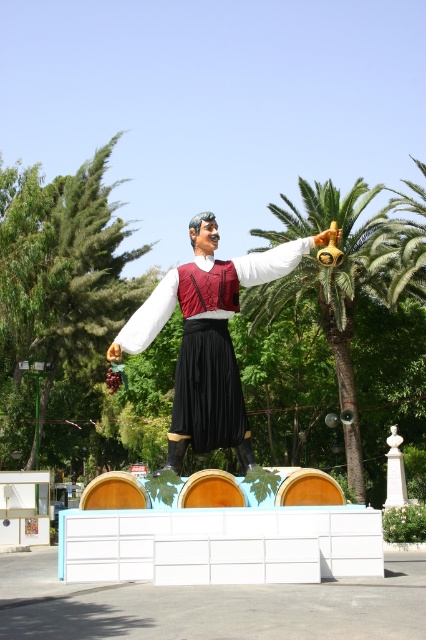
Can you confirm if matte black statue at center is wider than green leafy palm tree at center?

In fact, matte black statue at center might be narrower than green leafy palm tree at center.

Does matte black statue at center have a smaller size compared to green leafy palm tree at center?

Indeed, matte black statue at center has a smaller size compared to green leafy palm tree at center.

Is point (187, 444) less distant than point (360, 204)?

Yes, point (187, 444) is in front of point (360, 204).

Image resolution: width=426 pixels, height=640 pixels. In order to click on matte black statue at center in this screenshot , I will do `click(207, 339)`.